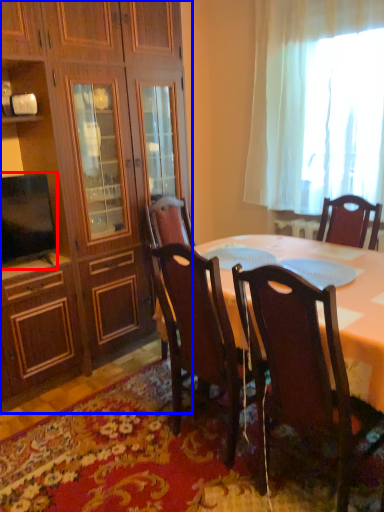
Question: Among these objects, which one is farthest to the camera, television (highlighted by a red box) or cabinetry (highlighted by a blue box)?

Choices:
 (A) television
 (B) cabinetry

Answer: (A)